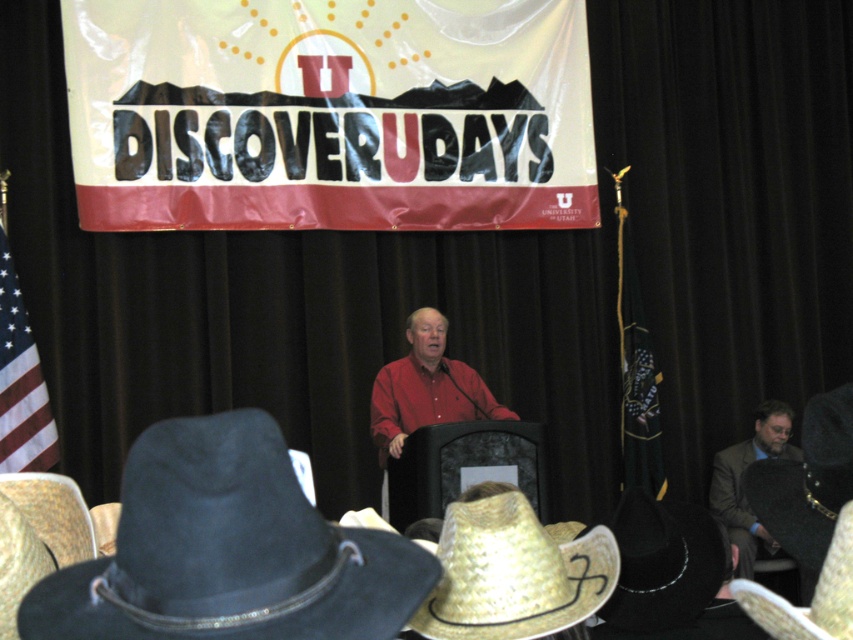
Question: Which object is closer to the camera taking this photo?

Choices:
 (A) brown leather jacket at lower right
 (B) straw textured cowboy hat at lower left

Answer: (B)

Question: Is black felt cowboy hat at lower left closer to the viewer compared to straw textured cowboy hat at lower left?

Choices:
 (A) no
 (B) yes

Answer: (B)

Question: Can you confirm if black felt cowboy hat at lower left is wider than red fabric flag at left?

Choices:
 (A) yes
 (B) no

Answer: (A)

Question: Does strawmaterial/texturecowboy hat at lower center come in front of straw textured cowboy hat at lower left?

Choices:
 (A) no
 (B) yes

Answer: (A)

Question: Which object appears farthest from the camera in this image?

Choices:
 (A) straw textured cowboy hat at lower right
 (B) red cotton shirt at center
 (C) straw textured cowboy hat at lower left
 (D) black felt cowboy hat at lower left

Answer: (B)

Question: Which object is the closest to the red fabric flag at left?

Choices:
 (A) black felt cowboy hat at lower center
 (B) straw textured cowboy hat at lower left
 (C) black felt cowboy hat at lower left
 (D) red cotton shirt at center

Answer: (D)